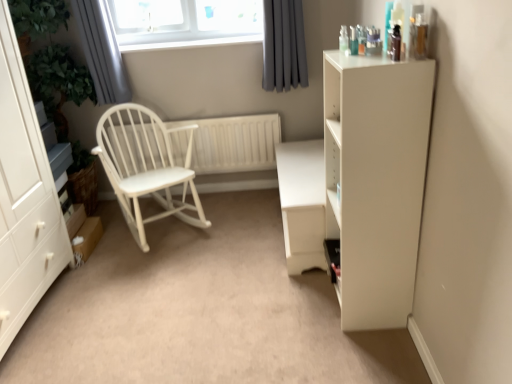
Identify the location of free spot below white wood rocking chair at left (from a real-world perspective). This screenshot has width=512, height=384. (158, 226).